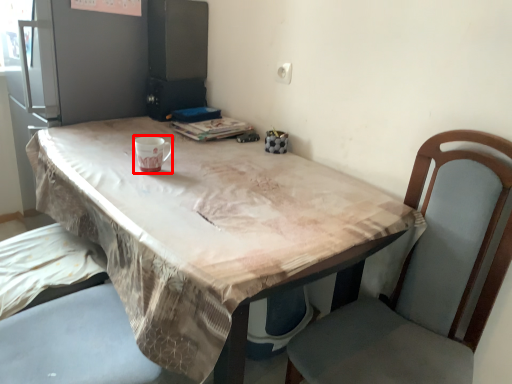
Question: From the image, what is the correct spatial relationship of mug (annotated by the red box) in relation to table?

Choices:
 (A) right
 (B) left

Answer: (B)